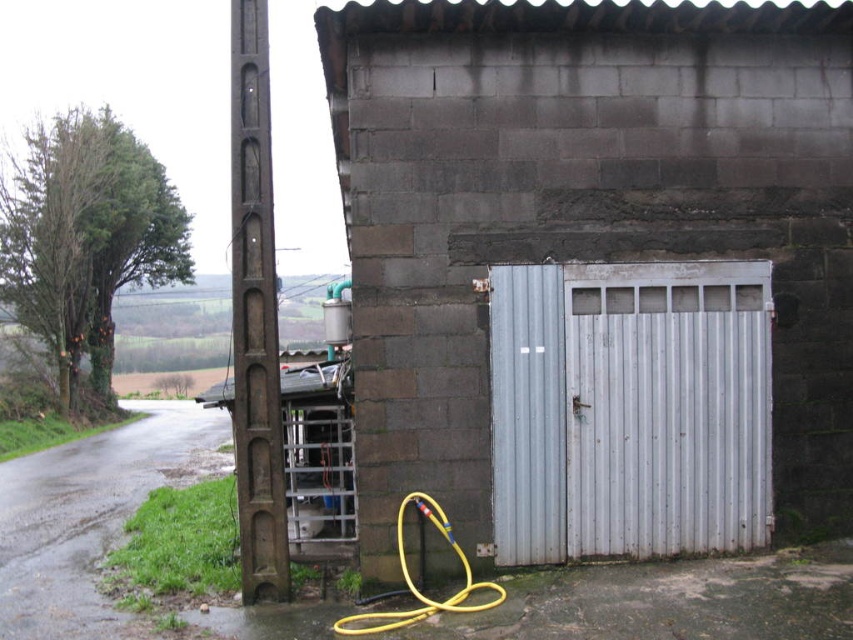
Question: Is white corrugated metal garage door at center closer to the viewer compared to wet asphalt road at lower left?

Choices:
 (A) no
 (B) yes

Answer: (A)

Question: Is white corrugated metal garage door at center to the right of wet asphalt road at lower left from the viewer's perspective?

Choices:
 (A) yes
 (B) no

Answer: (A)

Question: Which point is farther to the camera?

Choices:
 (A) white corrugated metal garage door at center
 (B) wet asphalt road at lower left
 (C) yellow rubber garden hose at lower center

Answer: (A)

Question: Can you confirm if white corrugated metal garage door at center is wider than yellow rubber garden hose at lower center?

Choices:
 (A) no
 (B) yes

Answer: (B)

Question: Which of these objects is positioned closest to the yellow rubber garden hose at lower center?

Choices:
 (A) white corrugated metal garage door at center
 (B) wet asphalt road at lower left

Answer: (A)

Question: Which point is farther to the camera?

Choices:
 (A) white corrugated metal garage door at center
 (B) yellow rubber garden hose at lower center

Answer: (A)